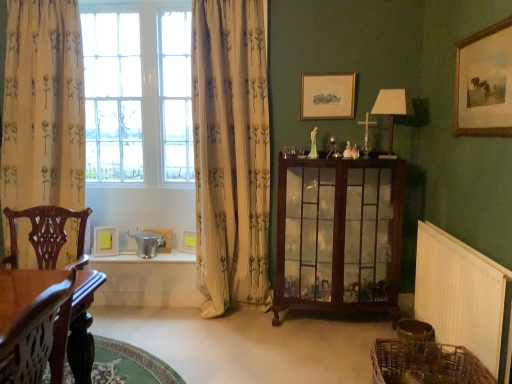
Question: From their relative heights in the image, would you say yellow paper at window, acting as the 3th picture frame starting from the bottom, is taller or shorter than wooden framed painting at upper right, positioned as the fourth picture frame in bottom-to-top order?

Choices:
 (A) tall
 (B) short

Answer: (B)

Question: In the image, is yellow paper at window, the fifth picture frame when ordered from right to left, positioned in front of or behind wooden framed painting at upper right, the 5th picture frame in the left-to-right sequence?

Choices:
 (A) front
 (B) behind

Answer: (B)

Question: Estimate the real-world distances between objects in this image. Which object is closer to the white fabric lampshade at right?

Choices:
 (A) mahogany glass cabinet at center
 (B) yellow paper at window, acting as the 3th picture frame starting from the bottom
 (C) woven brown basket at lower right
 (D) matte silver picture frame at upper center, which ranks as the fourth picture frame in left-to-right order
 (E) white floral fabric curtain at left, acting as the 1th curtain starting from the right

Answer: (D)

Question: Which of these objects is positioned farthest from the mahogany glass cabinet at center?

Choices:
 (A) white glass window at upper left
 (B) metallic silver picture frame at lower center, arranged as the first picture frame when viewed from the back
 (C) yellow paper at window, acting as the 3th picture frame starting from the bottom
 (D) woven brown basket at lower right
 (E) white floral fabric curtain at left, acting as the 1th curtain starting from the right

Answer: (C)